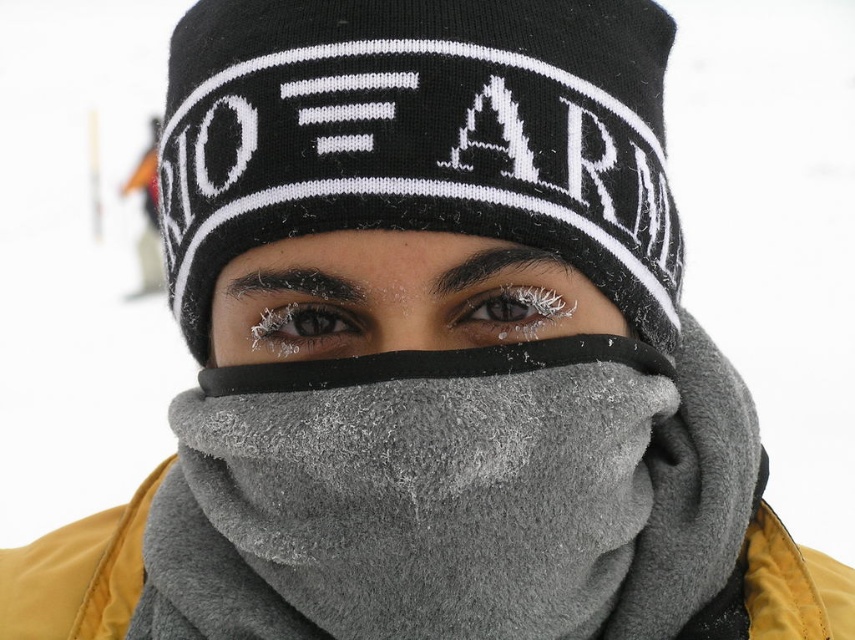
You are a photographer trying to capture a clear shot of the text on the black knitted beanie at center and the frosted gray scarf at center. Since both are at the center, which one do you need to focus on first to ensure the text is visible?

The black knitted beanie at center is in front of the frosted gray scarf at center, so you should focus on the black knitted beanie at center first to ensure the text is visible.

From the picture: You are trying to locate the black knitted beanie at center in the image. According to the coordinates provided, where exactly is it positioned?

The black knitted beanie at center is located at point coordinates (422, 136).

You are a photographer trying to capture the details of the black knitted beanie at center and the frosted gray scarf at center. From your current position, which object is positioned to the right side?

The black knitted beanie at center is positioned to the right of the frosted gray scarf at center.